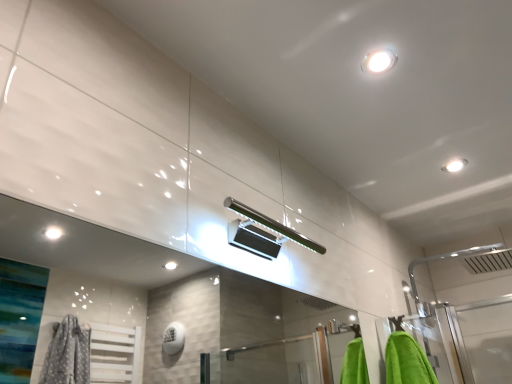
Describe the element at coordinates (454, 165) in the screenshot. I see `white glossy droplight at upper right` at that location.

The image size is (512, 384). I want to click on white glossy droplight at upper right, so (x=454, y=165).

Image resolution: width=512 pixels, height=384 pixels. What are the coordinates of `white glossy droplight at upper right` in the screenshot? It's located at (454, 165).